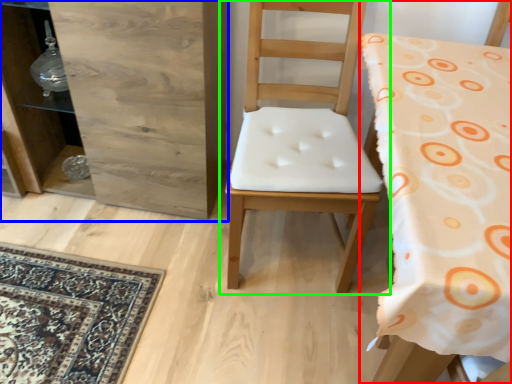
Question: Considering the real-world distances, which object is farthest from chair (highlighted by a red box)? dresser (highlighted by a blue box) or chair (highlighted by a green box)?

Choices:
 (A) dresser
 (B) chair

Answer: (A)